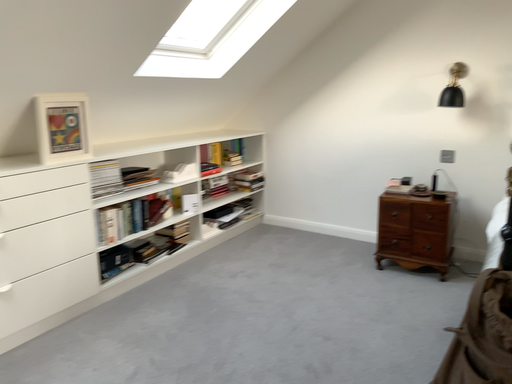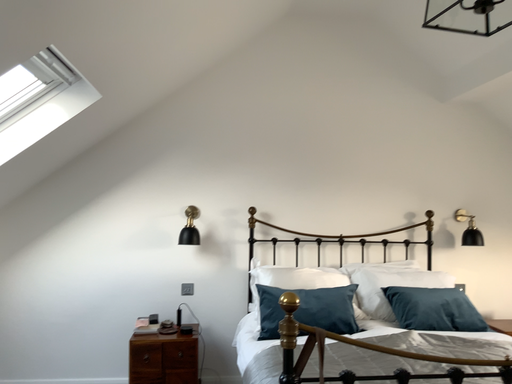
Question: How did the camera likely rotate when shooting the video?

Choices:
 (A) rotated left
 (B) rotated right

Answer: (B)